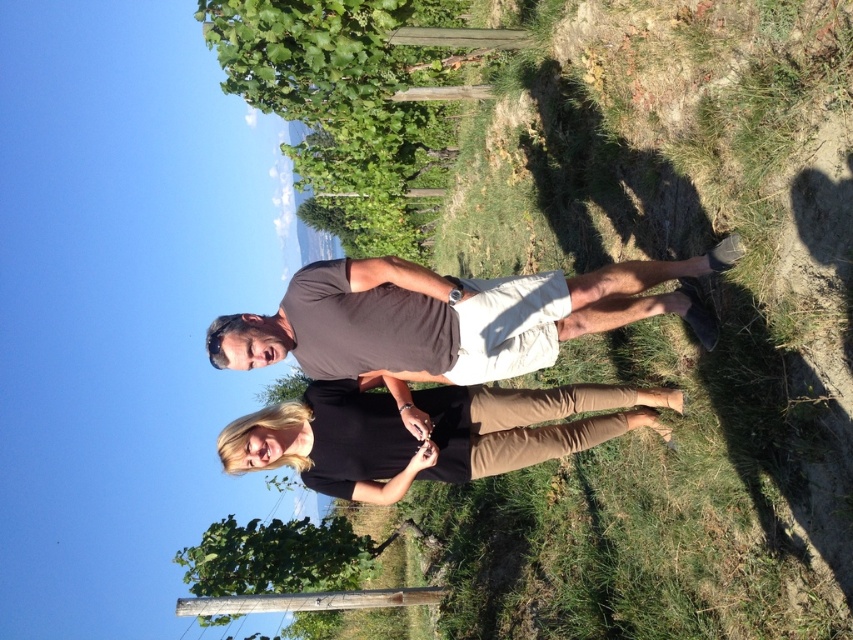
You are standing in a vineyard and want to reach a specific point marked at coordinates point (x=351, y=291). If you can walk 4 meters in 1 minute, how long will it take you to reach that point?

The distance of point (x=351, y=291) is 4.14 meters. Since you can walk 4 meters in 1 minute, it would take approximately 1.035 minutes to reach the point. Rounding up, it would take about 1 minute and 2 seconds.